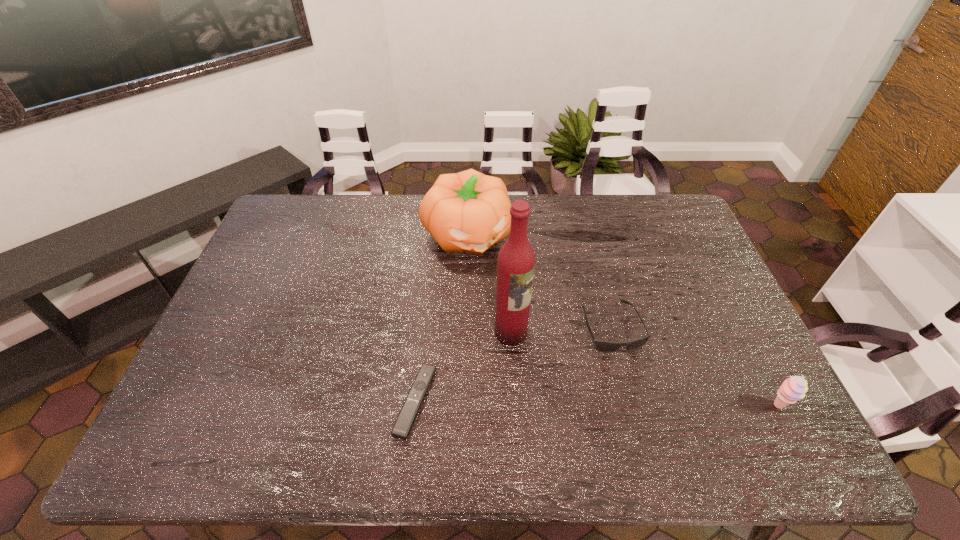
Where is `remote control that is positioned at the near edge`? remote control that is positioned at the near edge is located at coordinates (408, 413).

Where is `sherbert located in the near edge section of the desktop`? This screenshot has width=960, height=540. sherbert located in the near edge section of the desktop is located at coordinates (794, 388).

Locate an element on the screen. The image size is (960, 540). object that is at the right edge is located at coordinates (794, 388).

I want to click on object located at the near right corner, so (794, 388).

Find the location of a particular element. This screenshot has width=960, height=540. vacant space at the far edge of the desktop is located at coordinates (390, 219).

This screenshot has height=540, width=960. Find the location of `vacant space at the left edge`. vacant space at the left edge is located at coordinates (227, 317).

In the image, there is a desktop. What are the coordinates of `vacant space at the right edge` in the screenshot? It's located at (679, 244).

What are the coordinates of `vacant space at the far left corner of the desktop` in the screenshot? It's located at (289, 205).

Image resolution: width=960 pixels, height=540 pixels. I want to click on vacant area at the far right corner, so click(664, 206).

In order to click on free spot between the remote control and the tallest object in this screenshot , I will do `click(463, 367)`.